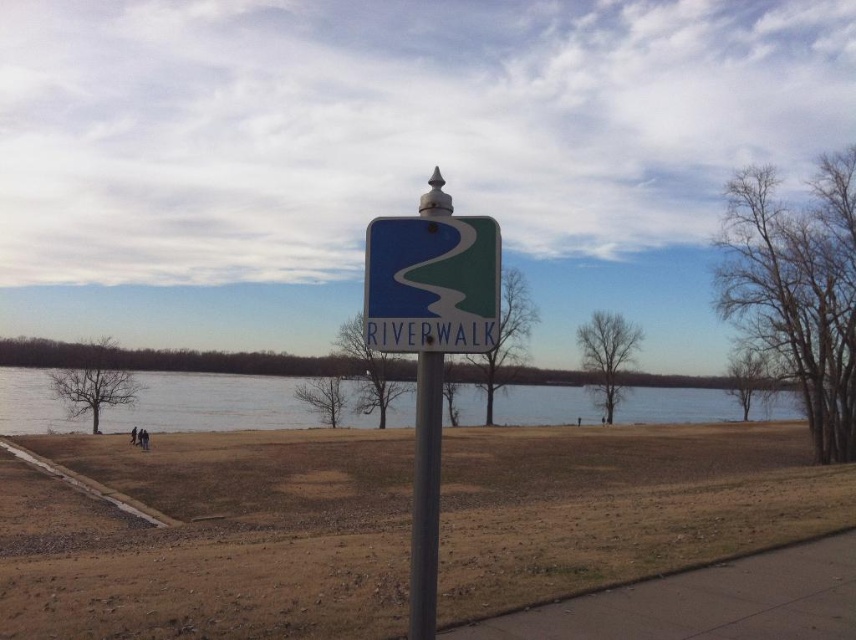
You are a hiker who wants to know if you can place a 1.2 meter long hiking pole between the gray asphalt pavement at lower right and the metallic pole at center. Can you do it?

The gray asphalt pavement at lower right is shorter than the metallic pole at center. Since the hiking pole is 1.2 meters long, it may not fit if the available space between them is narrower than 1.2 meters. However, the description only states the pavement is shorter than the pole, not the distance between them. Therefore, insufficient information is provided to determine if the hiking pole will fit.

You are a delivery robot with a 2.5 meter long package. You need to move from the gray asphalt pavement at lower right to the blue glossy sign at center. Is there enough space between them for your package to fit?

The distance between the gray asphalt pavement at lower right and the blue glossy sign at center is 2.90 meters. Since your package is 2.5 meters long, there is enough space for it to fit between them.